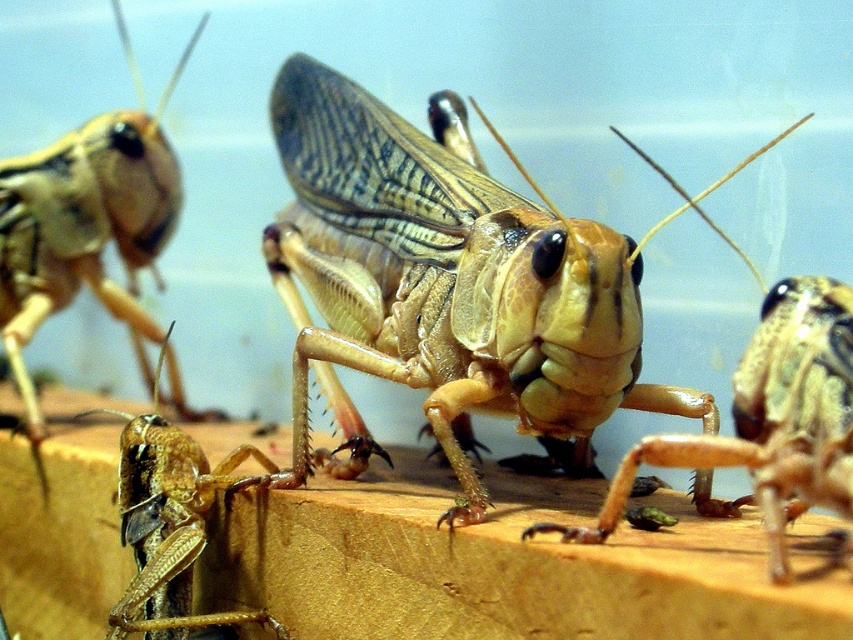
Is translucent beige grasshopper at lower left smaller than translucent beige grasshopper at center?

No, translucent beige grasshopper at lower left is not smaller than translucent beige grasshopper at center.

Can you confirm if translucent beige grasshopper at lower left is bigger than translucent beige grasshopper at center?

Yes.

Which is behind, point (9, 273) or point (711, 436)?

The point (9, 273) is behind.

Where is `translucent beige grasshopper at lower left`? The height and width of the screenshot is (640, 853). translucent beige grasshopper at lower left is located at coordinates (84, 228).

Who is positioned more to the right, translucent yellow grasshopper at center or translucent beige grasshopper at center?

From the viewer's perspective, translucent beige grasshopper at center appears more on the right side.

Is point (395, 192) farther from viewer compared to point (791, 461)?

Yes, it is behind point (791, 461).

Find the location of a particular element. The width and height of the screenshot is (853, 640). translucent yellow grasshopper at center is located at coordinates [444, 284].

Is translucent beige grasshopper at center positioned behind brown matte grasshopper at lower left?

That is False.

Between point (573, 528) and point (183, 468), which one is positioned in front?

Positioned in front is point (573, 528).

Locate an element on the screen. This screenshot has height=640, width=853. translucent beige grasshopper at center is located at coordinates (769, 419).